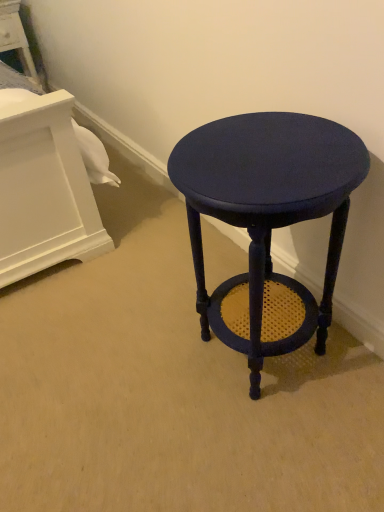
You are a GUI agent. You are given a task and a screenshot of the screen. Output one action in this format:
    pyautogui.click(x=<x>, y=<y>)
    Task: Click on the free space above navy fabric stool at center (from a real-world perspective)
    The image size is (384, 512).
    Given the screenshot: What is the action you would take?
    click(257, 154)